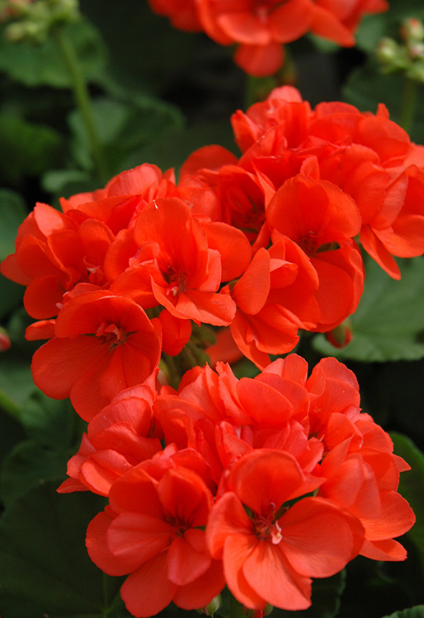
Where is `flower plant`? Image resolution: width=424 pixels, height=618 pixels. flower plant is located at coordinates (170, 146).